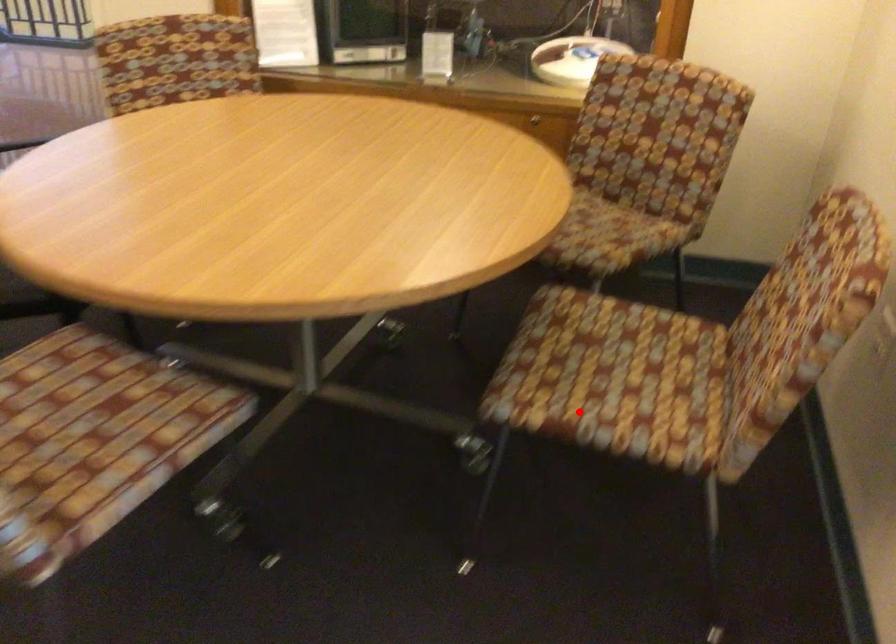
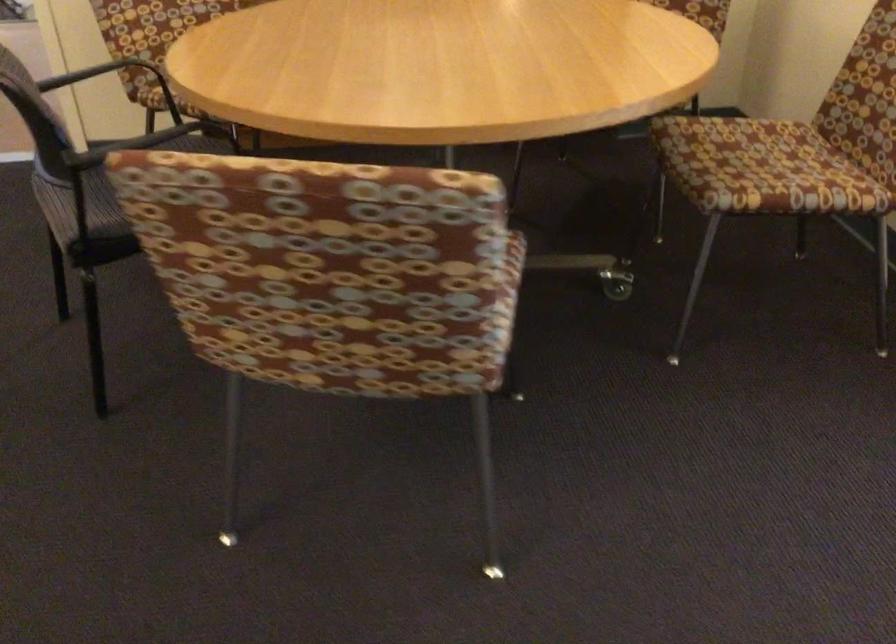
Question: A red point is marked in image1. In image2, is the corresponding 3D point closer to the camera or farther? Reply with the corresponding letter.

Choices:
 (A) The corresponding 3D point is closer.
 (B) The corresponding 3D point is farther.

Answer: (B)